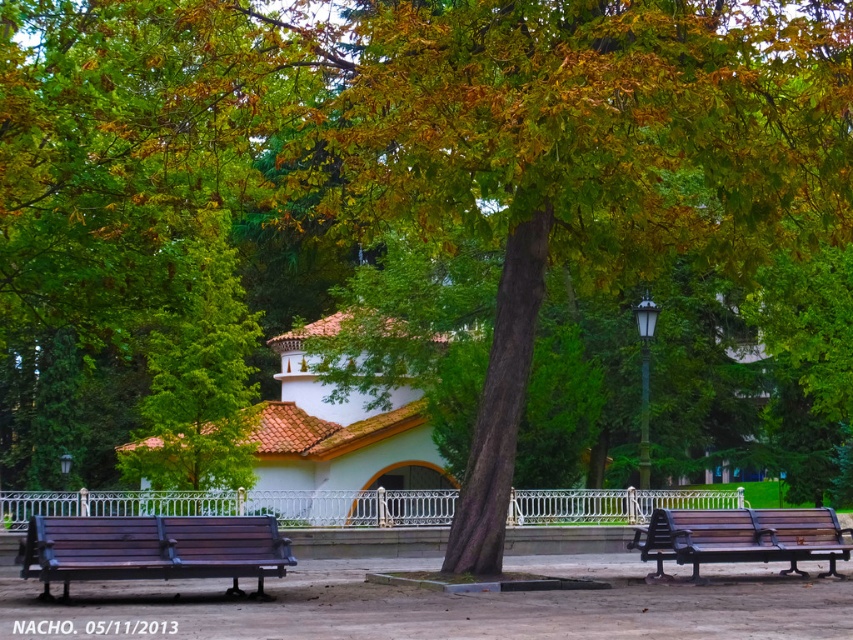
Does white matte chapel at center appear on the left side of brown wooden bench at right?

Indeed, white matte chapel at center is positioned on the left side of brown wooden bench at right.

Does white matte chapel at center appear over brown wooden bench at right?

Yes, white matte chapel at center is above brown wooden bench at right.

Where is `white matte chapel at center`? white matte chapel at center is located at coordinates (344, 449).

Can you confirm if white matte chapel at center is taller than wooden bench at lower left?

Indeed, white matte chapel at center has a greater height compared to wooden bench at lower left.

Is point (416, 428) closer to viewer compared to point (102, 556)?

No.

You are a GUI agent. You are given a task and a screenshot of the screen. Output one action in this format:
    pyautogui.click(x=<x>, y=<y>)
    Task: Click on the white matte chapel at center
    Image resolution: width=853 pixels, height=640 pixels.
    Given the screenshot: What is the action you would take?
    pyautogui.click(x=344, y=449)

Can you confirm if wooden bench at lower left is positioned below brown wooden bench at right?

Actually, wooden bench at lower left is above brown wooden bench at right.

Does wooden bench at lower left appear on the right side of brown wooden bench at right?

Incorrect, wooden bench at lower left is not on the right side of brown wooden bench at right.

I want to click on wooden bench at lower left, so click(154, 548).